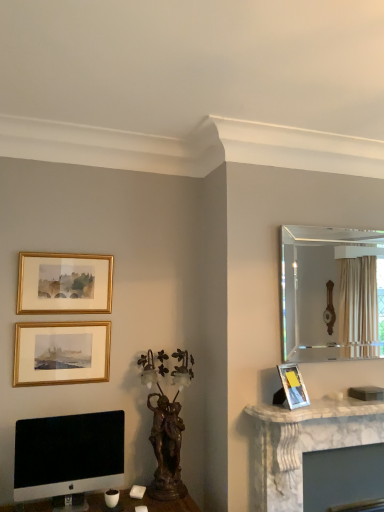
What is the approximate width of sleek silver monitor at lower left?

The width of sleek silver monitor at lower left is 4.43 inches.

Looking at this image, in order to face gold-framed picture at upper left, which is the 2th picture frame in top-to-bottom order, should I rotate leftwards or rightwards?

You should rotate left by 16.641 degrees.

What do you see at coordinates (315, 410) in the screenshot? Image resolution: width=384 pixels, height=512 pixels. I see `white marble fireplace at right` at bounding box center [315, 410].

Describe the element at coordinates (64, 283) in the screenshot. The image size is (384, 512). I see `gold framed picture at upper left, the 3th picture frame from the bottom` at that location.

Locate an element on the screen. This screenshot has width=384, height=512. sleek silver monitor at lower left is located at coordinates (68, 456).

From a real-world perspective, is gold framed picture at upper left, the 2th picture frame from the left, positioned under clear glass mirror at upper right based on gravity?

No, from a real-world perspective, gold framed picture at upper left, the 2th picture frame from the left, is not beneath clear glass mirror at upper right.

Which is more to the right, gold framed picture at upper left, the 1th picture frame positioned from the top, or clear glass mirror at upper right?

clear glass mirror at upper right.

Which is farther, (29, 303) or (301, 226)?

The point (301, 226) is farther.

Can you confirm if gold framed picture at upper left, the 3th picture frame from the bottom, is shorter than clear glass mirror at upper right?

Correct, gold framed picture at upper left, the 3th picture frame from the bottom, is not as tall as clear glass mirror at upper right.

Could you tell me if white marble fireplace at right is facing sleek silver monitor at lower left?

No, white marble fireplace at right is not facing towards sleek silver monitor at lower left.

Does point (345, 409) lie in front of point (50, 444)?

No.

How many degrees apart are the facing directions of white marble fireplace at right and sleek silver monitor at lower left?

The facing directions of white marble fireplace at right and sleek silver monitor at lower left are 0.753 degrees apart.

From a real-world perspective, which object stands above the other?

white marble fireplace at right.

Could you tell me if matte silver picture frame at right, the 1th picture frame in the bottom-to-top sequence, is turned towards white marble fireplace at right?

No, matte silver picture frame at right, the 1th picture frame in the bottom-to-top sequence, is not turned towards white marble fireplace at right.

I want to click on picture frame that is the 1st object above the white marble fireplace at right (from a real-world perspective), so [293, 386].

Can you tell me how much matte silver picture frame at right, arranged as the third picture frame when viewed from the top, and white marble fireplace at right differ in facing direction?

The angle between the facing direction of matte silver picture frame at right, arranged as the third picture frame when viewed from the top, and the facing direction of white marble fireplace at right is 22.2 degrees.

Is matte silver picture frame at right, arranged as the third picture frame when viewed from the top, not near white marble fireplace at right?

No, matte silver picture frame at right, arranged as the third picture frame when viewed from the top, is not far away from white marble fireplace at right.

Considering the relative positions of gold-framed picture at upper left, which is counted as the third picture frame, starting from the right, and sleek silver monitor at lower left in the image provided, is gold-framed picture at upper left, which is counted as the third picture frame, starting from the right, in front of sleek silver monitor at lower left?

No, gold-framed picture at upper left, which is counted as the third picture frame, starting from the right, is further to the viewer.

Can you confirm if gold-framed picture at upper left, which is counted as the third picture frame, starting from the right, is positioned to the left of sleek silver monitor at lower left?

Yes, gold-framed picture at upper left, which is counted as the third picture frame, starting from the right, is to the left of sleek silver monitor at lower left.

How far apart are gold-framed picture at upper left, placed as the first picture frame when sorted from left to right, and sleek silver monitor at lower left?

The distance of gold-framed picture at upper left, placed as the first picture frame when sorted from left to right, from sleek silver monitor at lower left is 14.67 inches.

Is gold-framed picture at upper left, the second picture frame in the bottom-to-top sequence, positioned beyond the bounds of sleek silver monitor at lower left?

gold-framed picture at upper left, the second picture frame in the bottom-to-top sequence, is positioned outside sleek silver monitor at lower left.

Between gold framed picture at upper left, the 3th picture frame from the bottom, and white marble fireplace at right, which one has larger width?

Wider between the two is white marble fireplace at right.

From the picture: Is gold framed picture at upper left, the 2th picture frame from the left, smaller than white marble fireplace at right?

Yes.

Which is in front, point (21, 252) or point (324, 432)?

The point (324, 432) is closer.

Can you tell me how much gold framed picture at upper left, the 1th picture frame positioned from the top, and white marble fireplace at right differ in facing direction?

There is a 0.134-degree angle between the facing directions of gold framed picture at upper left, the 1th picture frame positioned from the top, and white marble fireplace at right.

Who is bigger, gold framed picture at upper left, the 2th picture frame when ordered from right to left, or white marble fireplace at right?

white marble fireplace at right is bigger.

In the scene shown: Is gold framed picture at upper left, the 1th picture frame positioned from the top, to the left of white marble fireplace at right from the viewer's perspective?

Indeed, gold framed picture at upper left, the 1th picture frame positioned from the top, is positioned on the left side of white marble fireplace at right.

Does point (97, 311) come farther from viewer compared to point (321, 402)?

Yes, it is.

Locate an element on the screen. This screenshot has height=512, width=384. counter top in front of the gold framed picture at upper left, the 2th picture frame from the left is located at coordinates (315, 410).

Is sleek silver monitor at lower left taller or shorter than white marble fireplace at right?

sleek silver monitor at lower left is shorter than white marble fireplace at right.

Is sleek silver monitor at lower left behind white marble fireplace at right?

That is False.

Find the location of `computer desk that appears below the sleek silver monitor at lower left (from the image's perspective)`. computer desk that appears below the sleek silver monitor at lower left (from the image's perspective) is located at coordinates (304, 444).

Which of these two, sleek silver monitor at lower left or white marble fireplace at right, is bigger?

white marble fireplace at right is bigger.

You are a GUI agent. You are given a task and a screenshot of the screen. Output one action in this format:
    pyautogui.click(x=<x>, y=<y>)
    Task: Click on the mirror that appears below the gold framed picture at upper left, the 1th picture frame positioned from the top (from a real-world perspective)
    This screenshot has width=384, height=512.
    Given the screenshot: What is the action you would take?
    pyautogui.click(x=322, y=291)

At what (x,y) coordinates should I click in order to perform the action: click on computer monitor in front of the white marble fireplace at right. Please return your answer as a coordinate pair (x, y). Looking at the image, I should click on (68, 456).

Estimate the real-world distances between objects in this image. Which object is further from clear glass mirror at upper right, bronze/bronzed sculpture at center or sleek silver monitor at lower left?

sleek silver monitor at lower left lies further to clear glass mirror at upper right than the other object.

Looking at the image, which one is located further to gold-framed picture at upper left, which is the 2th picture frame in top-to-bottom order, white marble fireplace at right or matte silver picture frame at right, the 1th picture frame viewed from the right?

matte silver picture frame at right, the 1th picture frame viewed from the right, lies further to gold-framed picture at upper left, which is the 2th picture frame in top-to-bottom order, than the other object.

Looking at the image, which one is located closer to clear glass mirror at upper right, bronze/bronzed sculpture at center or white marble fireplace at right?

white marble fireplace at right lies closer to clear glass mirror at upper right than the other object.

Considering their positions, is sleek silver monitor at lower left positioned further to white marble fireplace at right than bronze/bronzed sculpture at center?

Based on the image, sleek silver monitor at lower left appears to be further to white marble fireplace at right.

In the scene shown: Estimate the real-world distances between objects in this image. Which object is further from matte silver picture frame at right, arranged as the third picture frame when viewed from the top, sleek silver monitor at lower left or bronze/bronzed sculpture at center?

The object further to matte silver picture frame at right, arranged as the third picture frame when viewed from the top, is sleek silver monitor at lower left.

Which object lies nearer to the anchor point matte silver picture frame at right, the 1th picture frame in the bottom-to-top sequence, bronze/bronzed sculpture at center or gold-framed picture at upper left, the second picture frame in the bottom-to-top sequence?

Based on the image, bronze/bronzed sculpture at center appears to be nearer to matte silver picture frame at right, the 1th picture frame in the bottom-to-top sequence.

Which object lies nearer to the anchor point white marble fireplace at right, white marble fireplace at right or gold-framed picture at upper left, which is counted as the third picture frame, starting from the right?

The object closer to white marble fireplace at right is white marble fireplace at right.

Looking at the image, which one is located further to matte silver picture frame at right, arranged as the third picture frame when viewed from the top, gold framed picture at upper left, the 1th picture frame positioned from the top, or sleek silver monitor at lower left?

The object further to matte silver picture frame at right, arranged as the third picture frame when viewed from the top, is gold framed picture at upper left, the 1th picture frame positioned from the top.

Where is `picture frame located between gold framed picture at upper left, the 3th picture frame from the bottom, and white marble fireplace at right in the left-right direction`? This screenshot has height=512, width=384. picture frame located between gold framed picture at upper left, the 3th picture frame from the bottom, and white marble fireplace at right in the left-right direction is located at coordinates (293, 386).

Find the location of a particular element. counter top between matte silver picture frame at right, the 1th picture frame in the bottom-to-top sequence, and white marble fireplace at right from top to bottom is located at coordinates (315, 410).

Identify the location of computer desk between gold framed picture at upper left, the 2th picture frame when ordered from right to left, and clear glass mirror at upper right. The width and height of the screenshot is (384, 512). (304, 444).

At what (x,y) coordinates should I click in order to perform the action: click on computer monitor between gold-framed picture at upper left, the second picture frame in the bottom-to-top sequence, and matte silver picture frame at right, the 1th picture frame viewed from the right, from left to right. Please return your answer as a coordinate pair (x, y). The image size is (384, 512). Looking at the image, I should click on (68, 456).